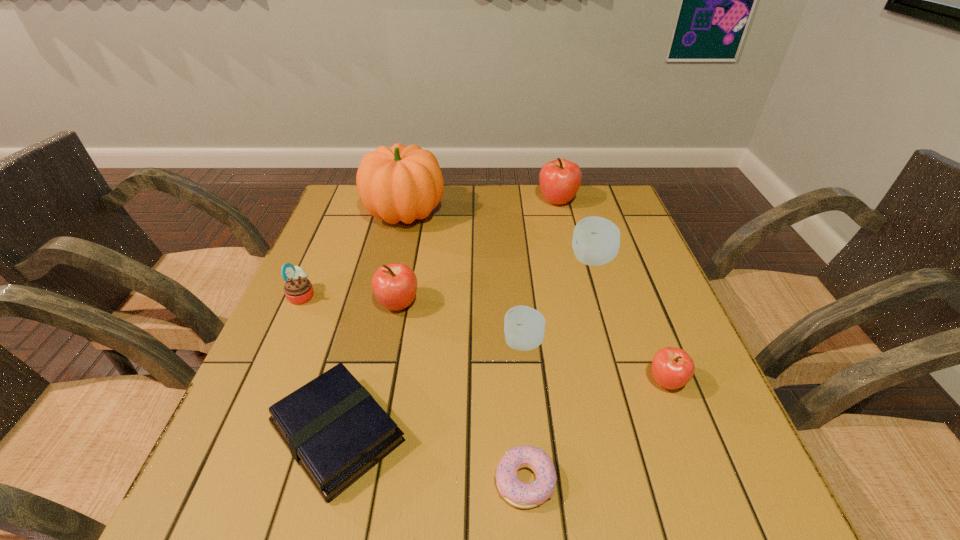
This screenshot has height=540, width=960. What are the coordinates of `vacant space at the far left corner of the desktop` in the screenshot? It's located at (354, 195).

The width and height of the screenshot is (960, 540). In order to click on vacant space at the far right corner in this screenshot , I will do `click(602, 190)`.

This screenshot has width=960, height=540. In order to click on free space between the nearer white apple and the orange pumpkin in this screenshot , I will do `click(465, 278)`.

The height and width of the screenshot is (540, 960). Find the location of `vacant region between the second smallest pink apple and the blue book`. vacant region between the second smallest pink apple and the blue book is located at coordinates (368, 369).

Identify the location of vacant space in between the pumpkin and the right white apple. Image resolution: width=960 pixels, height=540 pixels. (499, 237).

Where is `free spot between the nearer white apple and the pink muffin`? This screenshot has width=960, height=540. free spot between the nearer white apple and the pink muffin is located at coordinates (413, 319).

The width and height of the screenshot is (960, 540). Find the location of `free space between the orange pumpkin and the third nearest apple`. free space between the orange pumpkin and the third nearest apple is located at coordinates (401, 259).

Identify the location of vacant area between the rightmost pink apple and the second pink apple from left to right. (612, 292).

In order to click on free spot between the tallest object and the bigger white apple in this screenshot , I will do `click(499, 237)`.

I want to click on vacant area that lies between the second nearest apple and the farther white apple, so click(558, 301).